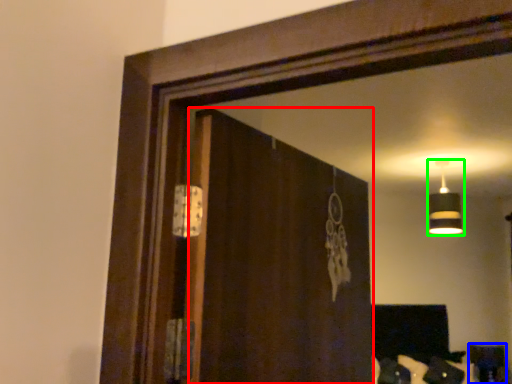
Question: Which object is the farthest from screen door (highlighted by a red box)? Choose among these: furniture (highlighted by a blue box) or lamp (highlighted by a green box).

Choices:
 (A) furniture
 (B) lamp

Answer: (A)